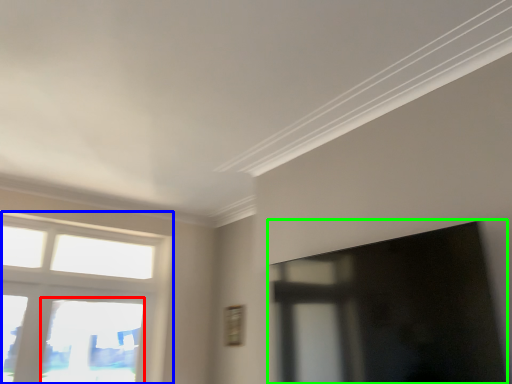
Question: Which object is the closest to the window (highlighted by a red box)? Choose among these: window (highlighted by a blue box) or window screen (highlighted by a green box).

Choices:
 (A) window
 (B) window screen

Answer: (A)